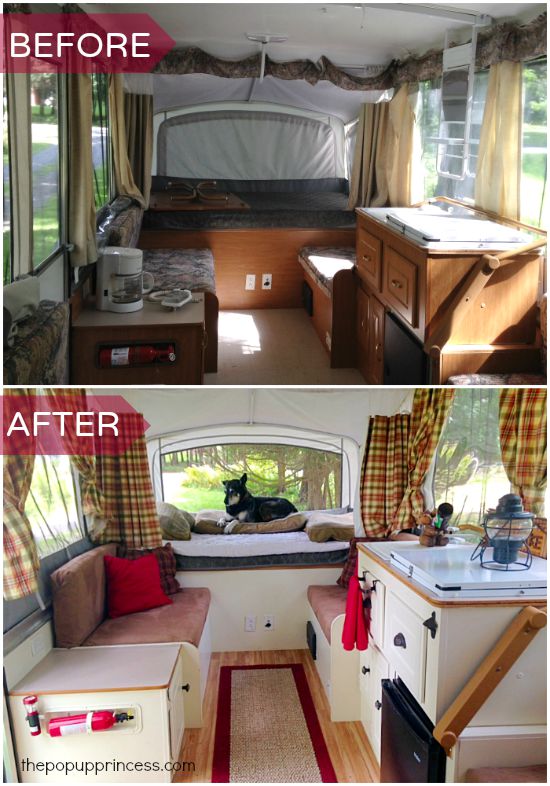
The height and width of the screenshot is (786, 550). Find the location of `drawer`. drawer is located at coordinates (405, 649).